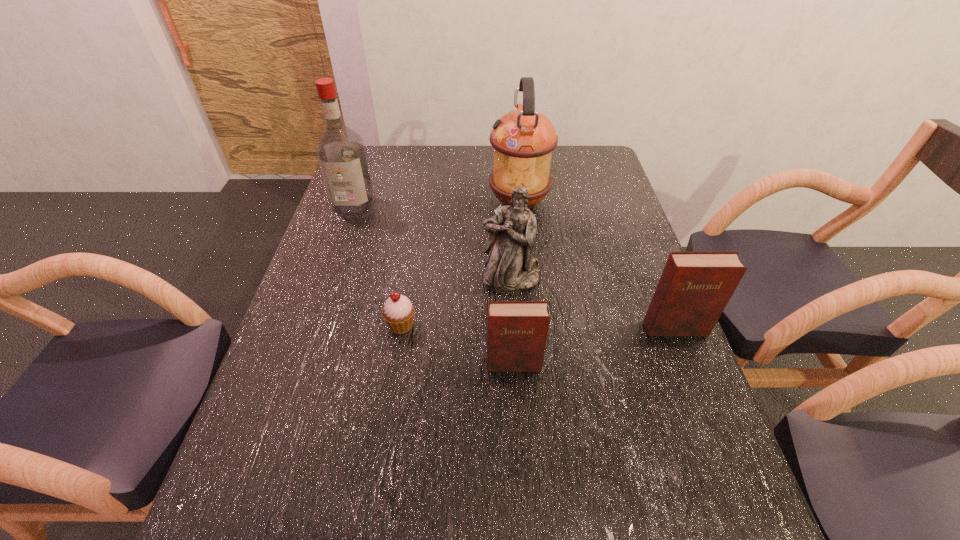
Given the evenly spaced diarys in the image, where should an extra diary be added on the left to preserve the spacing? Please point to a vacant space. Please provide its 2D coordinates. Your answer should be formatted as a tuple, i.e. [(x, y)], where the tuple contains the x and y coordinates of a point satisfying the conditions above.

[(326, 406)]